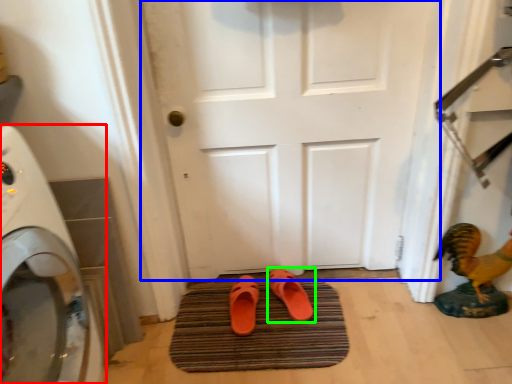
Question: Based on their relative distances, which object is nearer to home appliance (highlighted by a red box)? Choose from door (highlighted by a blue box) and footwear (highlighted by a green box).

Choices:
 (A) door
 (B) footwear

Answer: (A)